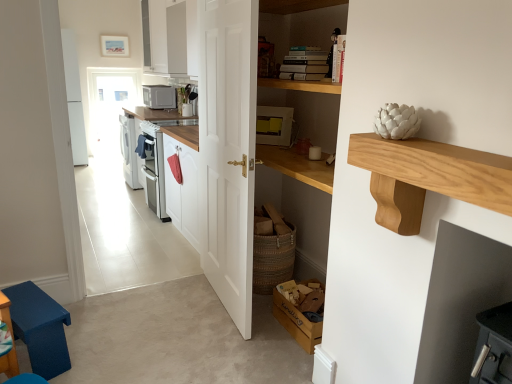
At what (x,y) coordinates should I click in order to perform the action: click on blank space situated above light wood shelf at upper right (from a real-world perspective). Please return your answer as a coordinate pair (x, y). Looking at the image, I should click on (438, 144).